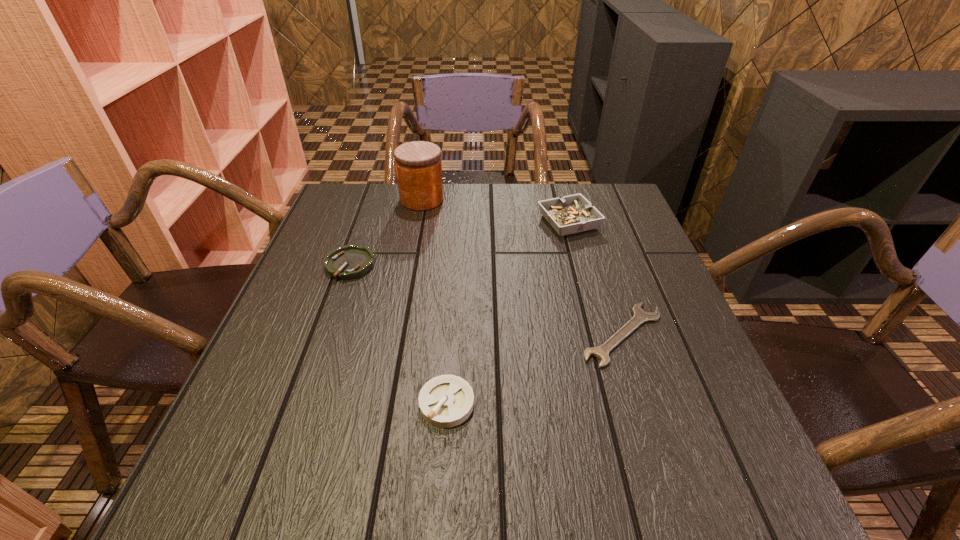
You are a GUI agent. You are given a task and a screenshot of the screen. Output one action in this format:
    pyautogui.click(x=<x>, y=<y>)
    Task: Click on the free space that is in between the shortest object and the fourth shortest object
    
    Given the screenshot: What is the action you would take?
    pyautogui.click(x=596, y=278)

This screenshot has width=960, height=540. I want to click on free point between the second farthest ashtray and the tallest ashtray, so click(460, 244).

Locate an element on the screen. The image size is (960, 540). free space between the nearest object and the shortest object is located at coordinates pos(535,369).

Locate an element on the screen. This screenshot has height=540, width=960. empty location between the fourth shortest object and the tallest object is located at coordinates click(x=495, y=211).

Where is `free spot between the tallest object and the nearest object`? free spot between the tallest object and the nearest object is located at coordinates (434, 301).

You are a GUI agent. You are given a task and a screenshot of the screen. Output one action in this format:
    pyautogui.click(x=<x>, y=<y>)
    Task: Click on the unoccupied area between the second ashtray from left to right and the tallest object
    This screenshot has height=540, width=960.
    Given the screenshot: What is the action you would take?
    pyautogui.click(x=434, y=301)

Locate which object ranks in proximity to the rightmost ashtray. Please provide its 2D coordinates. Your answer should be formatted as a tuple, i.e. [(x, y)], where the tuple contains the x and y coordinates of a point satisfying the conditions above.

[(640, 316)]

Identify which object is located as the nearest to the tallest ashtray. Please provide its 2D coordinates. Your answer should be formatted as a tuple, i.e. [(x, y)], where the tuple contains the x and y coordinates of a point satisfying the conditions above.

[(640, 316)]

Identify which ashtray is located as the second nearest to the leftmost object. Please provide its 2D coordinates. Your answer should be formatted as a tuple, i.e. [(x, y)], where the tuple contains the x and y coordinates of a point satisfying the conditions above.

[(571, 214)]

You are a GUI agent. You are given a task and a screenshot of the screen. Output one action in this format:
    pyautogui.click(x=<x>, y=<y>)
    Task: Click on the ashtray object that ranks as the third closest to the tallest object
    The height and width of the screenshot is (540, 960).
    Given the screenshot: What is the action you would take?
    pyautogui.click(x=445, y=401)